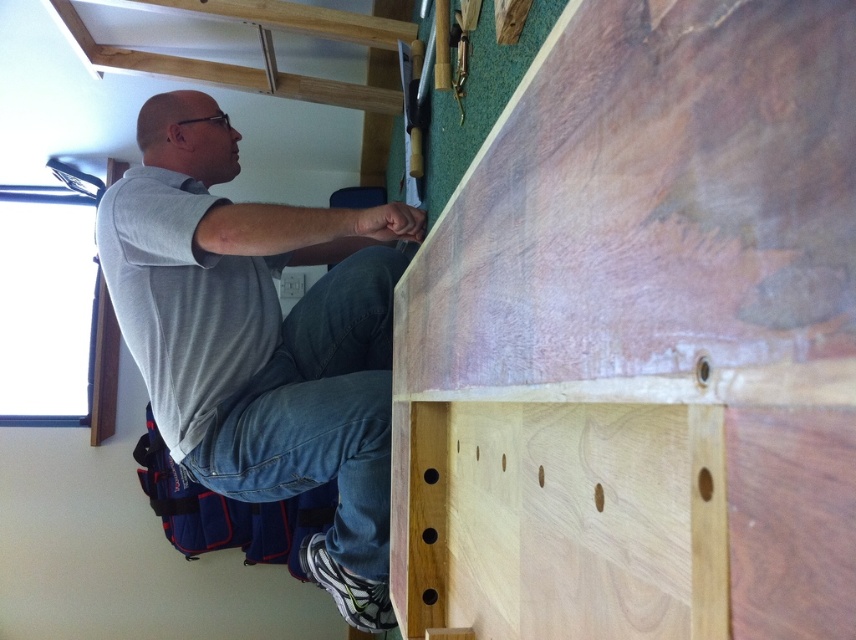
Which of these two, natural wood plywood at center or gray cotton shirt at upper left, stands shorter?

Standing shorter between the two is natural wood plywood at center.

Does natural wood plywood at center have a greater width compared to gray cotton shirt at upper left?

No.

Locate an element on the screen. The width and height of the screenshot is (856, 640). natural wood plywood at center is located at coordinates (x=642, y=340).

Identify the location of natural wood plywood at center. (642, 340).